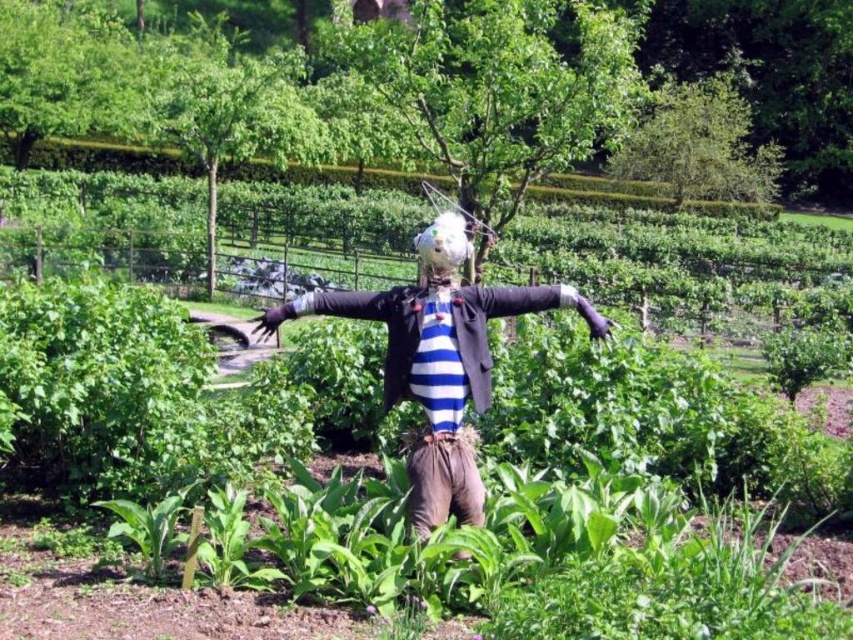
Consider the image. You are a gardener who wants to place a new decorative flag between the striped fabric scarecrow at center and the white fabric head at center. Based on their widths, which object should the flag be placed closer to?

The striped fabric scarecrow at center is wider than the white fabric head at center. Therefore, the flag should be placed closer to the white fabric head at center to ensure proper spacing between the two objects.

You are a gardener standing at the point labeled as point (x=460, y=262). You want to reach the point labeled as point (x=440, y=369) to plant a new flower. Is there a clear path directly between these two points without any obstacles?

Yes, there is a clear path between point (x=460, y=262) and point (x=440, y=369) because point (x=440, y=369) is in front of point (x=460, y=262), indicating no obstruction between them.